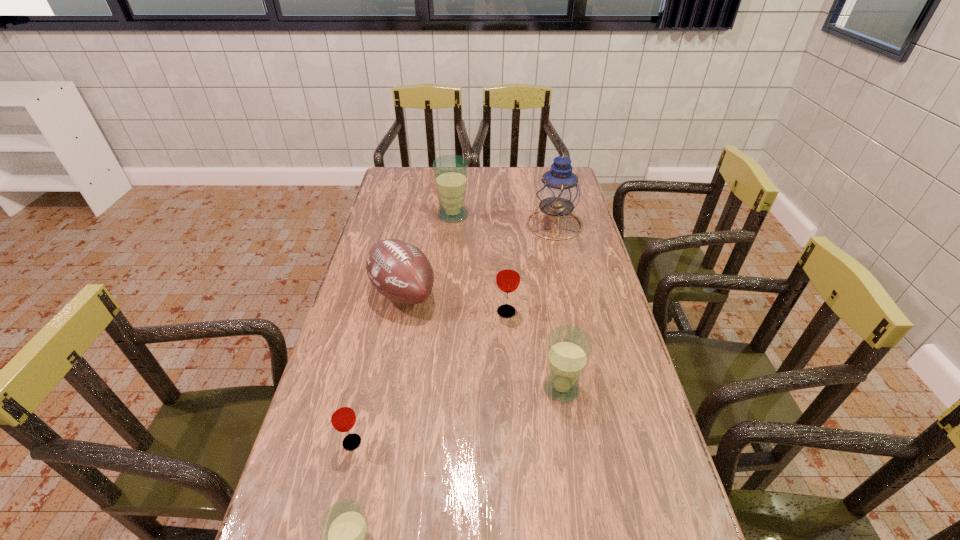
Find the location of a particular element. the tallest object is located at coordinates (558, 192).

Identify the location of lantern. This screenshot has width=960, height=540. (558, 192).

What are the coordinates of `the farthest glass` in the screenshot? It's located at (450, 172).

The image size is (960, 540). What are the coordinates of `the second tallest object` in the screenshot? It's located at (450, 172).

The image size is (960, 540). What are the coordinates of `football (American)` in the screenshot? It's located at (401, 272).

The image size is (960, 540). What are the coordinates of `the right red glass` in the screenshot? It's located at (508, 277).

You are a GUI agent. You are given a task and a screenshot of the screen. Output one action in this format:
    pyautogui.click(x=<x>, y=<y>)
    Task: Click on the bigger red glass
    
    Given the screenshot: What is the action you would take?
    pyautogui.click(x=508, y=277)

This screenshot has height=540, width=960. Identify the location of the second smallest blue glass. (569, 348).

Locate an element on the screen. the third nearest object is located at coordinates (569, 348).

I want to click on the fourth farthest glass, so pos(342,416).